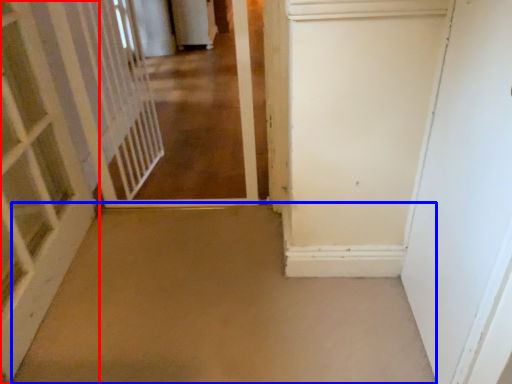
Question: Which of the following is the farthest to the observer, door (highlighted by a red box) or concrete (highlighted by a blue box)?

Choices:
 (A) door
 (B) concrete

Answer: (B)